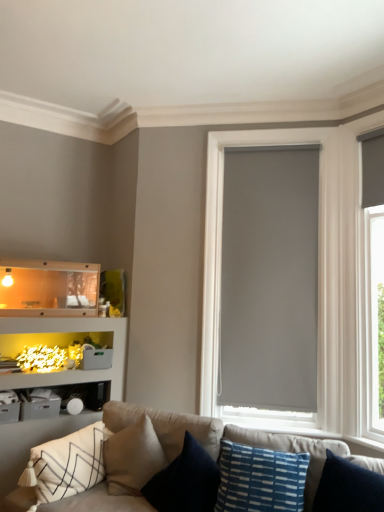
Question: Is matte gray roller shade at center touching blue textured pillow at lower center, which ranks as the 1th pillow in right-to-left order?

Choices:
 (A) no
 (B) yes

Answer: (A)

Question: Is matte gray roller shade at center positioned in front of blue textured pillow at lower center, which is the third pillow in left-to-right order?

Choices:
 (A) yes
 (B) no

Answer: (B)

Question: Are matte gray roller shade at center and blue textured pillow at lower center, which is the third pillow in left-to-right order, located far from each other?

Choices:
 (A) yes
 (B) no

Answer: (A)

Question: Considering the relative sizes of matte gray roller shade at center and blue textured pillow at lower center, which ranks as the 1th pillow in right-to-left order, in the image provided, is matte gray roller shade at center taller than blue textured pillow at lower center, which ranks as the 1th pillow in right-to-left order,?

Choices:
 (A) no
 (B) yes

Answer: (B)

Question: Considering the relative sizes of matte gray roller shade at center and blue textured pillow at lower center, which is the third pillow in left-to-right order, in the image provided, is matte gray roller shade at center thinner than blue textured pillow at lower center, which is the third pillow in left-to-right order,?

Choices:
 (A) no
 (B) yes

Answer: (B)

Question: From a real-world perspective, relative to matte gray roller shade at center, is blue textured pillow at lower center, which ranks as the 1th pillow in right-to-left order, vertically above or below?

Choices:
 (A) below
 (B) above

Answer: (A)

Question: Does point (246, 501) appear closer or farther from the camera than point (339, 364)?

Choices:
 (A) farther
 (B) closer

Answer: (B)

Question: Is blue textured pillow at lower center, which is the third pillow in left-to-right order, in front of or behind matte gray roller shade at center in the image?

Choices:
 (A) behind
 (B) front

Answer: (B)

Question: From the image's perspective, is blue textured pillow at lower center, which is the third pillow in left-to-right order, located above or below matte gray roller shade at center?

Choices:
 (A) below
 (B) above

Answer: (A)

Question: Considering the relative positions of matte gray roller shade at center and white textured pillow at lower left, positioned as the 3th pillow in right-to-left order, in the image provided, is matte gray roller shade at center to the left or to the right of white textured pillow at lower left, positioned as the 3th pillow in right-to-left order,?

Choices:
 (A) left
 (B) right

Answer: (B)

Question: From a real-world perspective, relative to white textured pillow at lower left, positioned as the 3th pillow in right-to-left order, is matte gray roller shade at center vertically above or below?

Choices:
 (A) above
 (B) below

Answer: (A)

Question: Would you say matte gray roller shade at center is inside or outside white textured pillow at lower left, positioned as the 3th pillow in right-to-left order?

Choices:
 (A) outside
 (B) inside

Answer: (A)

Question: Considering their positions, is matte gray roller shade at center located in front of or behind white textured pillow at lower left, which is counted as the first pillow, starting from the left?

Choices:
 (A) behind
 (B) front

Answer: (A)

Question: Looking at their shapes, would you say soft beige fabric couch at lower center is wider or thinner than translucent plastic shelf at lower left?

Choices:
 (A) thin
 (B) wide

Answer: (B)

Question: Considering the positions of soft beige fabric couch at lower center and translucent plastic shelf at lower left in the image, is soft beige fabric couch at lower center bigger or smaller than translucent plastic shelf at lower left?

Choices:
 (A) small
 (B) big

Answer: (B)